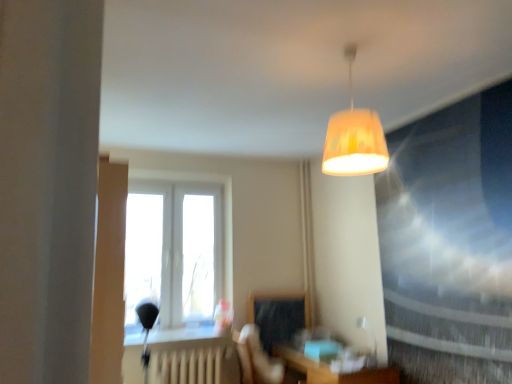
Question: Would you say white matte radiator at lower center is part of matte glass window screen at upper right's contents?

Choices:
 (A) yes
 (B) no

Answer: (B)

Question: From a real-world perspective, is matte glass window screen at upper right positioned over white matte radiator at lower center based on gravity?

Choices:
 (A) yes
 (B) no

Answer: (A)

Question: Are matte glass window screen at upper right and white matte radiator at lower center beside each other?

Choices:
 (A) no
 (B) yes

Answer: (A)

Question: Is matte glass window screen at upper right positioned far away from white matte radiator at lower center?

Choices:
 (A) yes
 (B) no

Answer: (A)

Question: Can you confirm if matte glass window screen at upper right is positioned to the right of white matte radiator at lower center?

Choices:
 (A) yes
 (B) no

Answer: (A)

Question: From the image's perspective, is matte yellow lampshade at center located above or below matte black swivel chair at center?

Choices:
 (A) above
 (B) below

Answer: (A)

Question: Would you say matte yellow lampshade at center is to the left or to the right of matte black swivel chair at center in the picture?

Choices:
 (A) left
 (B) right

Answer: (B)

Question: From a real-world perspective, relative to matte black swivel chair at center, is matte yellow lampshade at center vertically above or below?

Choices:
 (A) above
 (B) below

Answer: (A)

Question: Considering their positions, is matte yellow lampshade at center located in front of or behind matte black swivel chair at center?

Choices:
 (A) behind
 (B) front

Answer: (B)

Question: Is wooden table at lower center situated inside matte yellow lampshade at center or outside?

Choices:
 (A) outside
 (B) inside

Answer: (A)

Question: Looking at their shapes, would you say wooden table at lower center is wider or thinner than matte yellow lampshade at center?

Choices:
 (A) wide
 (B) thin

Answer: (A)

Question: Considering their positions, is wooden table at lower center located in front of or behind matte yellow lampshade at center?

Choices:
 (A) front
 (B) behind

Answer: (B)

Question: From a real-world perspective, relative to matte yellow lampshade at center, is wooden table at lower center vertically above or below?

Choices:
 (A) below
 (B) above

Answer: (A)

Question: From the image's perspective, is wooden table at lower center positioned above or below white glossy table lamp at lower right?

Choices:
 (A) below
 (B) above

Answer: (A)

Question: Considering the relative positions of wooden table at lower center and white glossy table lamp at lower right in the image provided, is wooden table at lower center to the left or to the right of white glossy table lamp at lower right?

Choices:
 (A) left
 (B) right

Answer: (A)